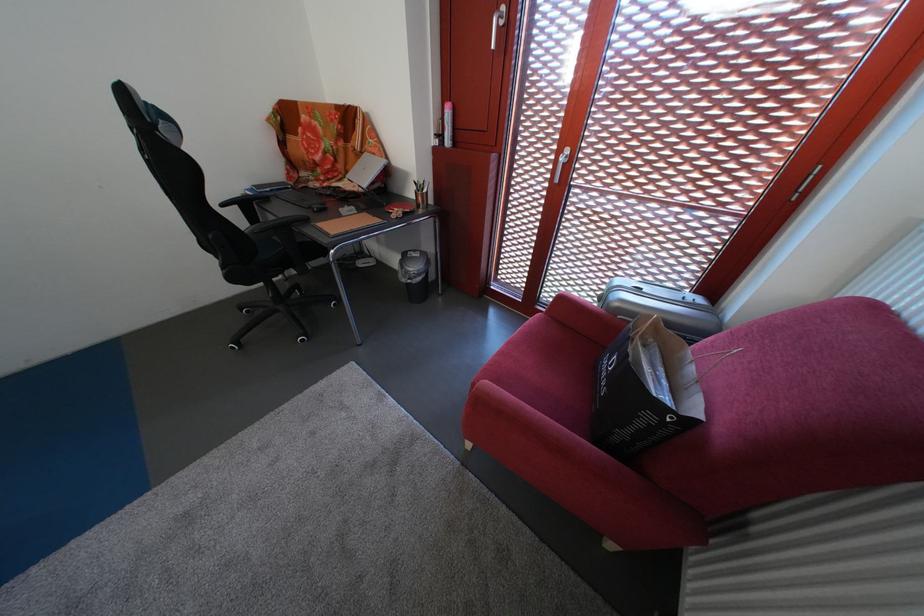
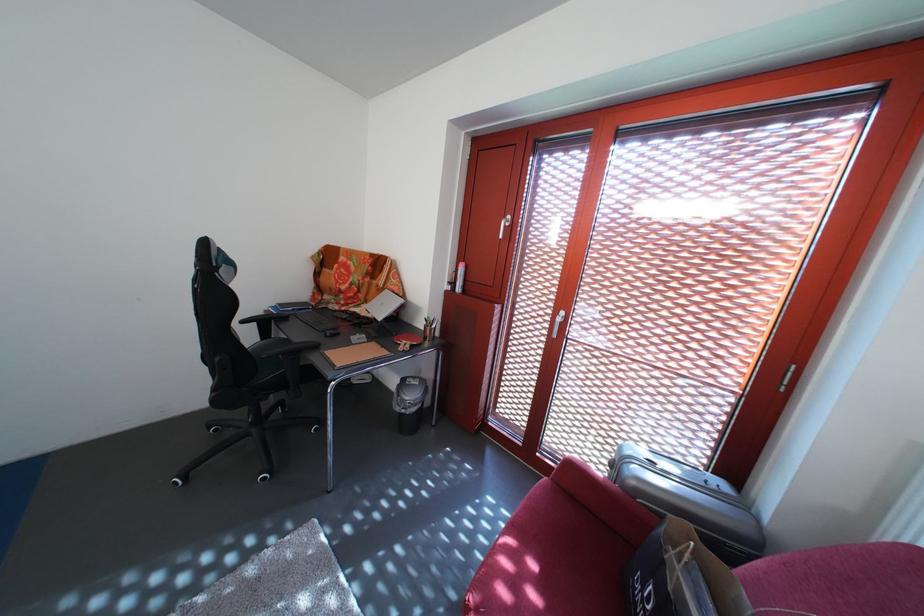
Find the pixel in the second image that matches (x=612, y=305) in the first image.

(623, 471)